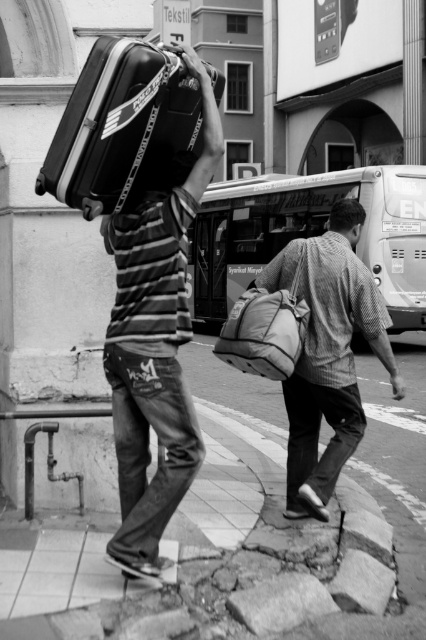
Question: Does matte black suitcase at upper left come behind metallic silver bus at center?

Choices:
 (A) yes
 (B) no

Answer: (A)

Question: Which point is closer to the camera?

Choices:
 (A) smooth concrete pavement at lower center
 (B) checkered fabric shirt at center

Answer: (A)

Question: Which is farther from the textured canvas backpack at center?

Choices:
 (A) matte black suitcase at upper left
 (B) metallic silver bus at center
 (C) black hardshell suitcase at upper left
 (D) smooth concrete pavement at lower center

Answer: (B)

Question: Which of these objects is positioned closest to the checkered fabric shirt at center?

Choices:
 (A) matte black suitcase at upper left
 (B) smooth concrete pavement at lower center
 (C) metallic silver bus at center

Answer: (B)

Question: Does matte black suitcase at upper left lie behind metallic silver bus at center?

Choices:
 (A) yes
 (B) no

Answer: (A)

Question: Does black hardshell suitcase at upper left come behind textured canvas backpack at center?

Choices:
 (A) no
 (B) yes

Answer: (A)